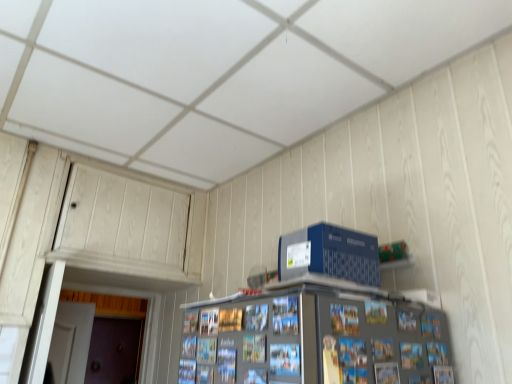
Question: From a real-world perspective, is brown matte door at lower left above or below blue plastic computer at upper right?

Choices:
 (A) below
 (B) above

Answer: (A)

Question: Relative to blue plastic computer at upper right, is brown matte door at lower left in front or behind?

Choices:
 (A) front
 (B) behind

Answer: (B)

Question: Visually, is brown matte door at lower left positioned to the left or to the right of blue plastic computer at upper right?

Choices:
 (A) right
 (B) left

Answer: (B)

Question: Considering their positions, is blue plastic computer at upper right located in front of or behind brown matte door at lower left?

Choices:
 (A) behind
 (B) front

Answer: (B)

Question: Looking at the image, does blue plastic computer at upper right seem bigger or smaller compared to brown matte door at lower left?

Choices:
 (A) big
 (B) small

Answer: (B)

Question: From their relative heights in the image, would you say blue plastic computer at upper right is taller or shorter than brown matte door at lower left?

Choices:
 (A) short
 (B) tall

Answer: (A)

Question: Is point (290, 259) closer or farther from the camera than point (111, 357)?

Choices:
 (A) farther
 (B) closer

Answer: (B)